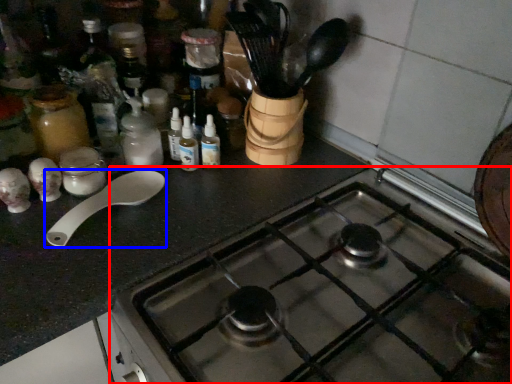
Question: Which object appears farthest to the camera in this image, gas stove (highlighted by a red box) or spoon (highlighted by a blue box)?

Choices:
 (A) gas stove
 (B) spoon

Answer: (B)